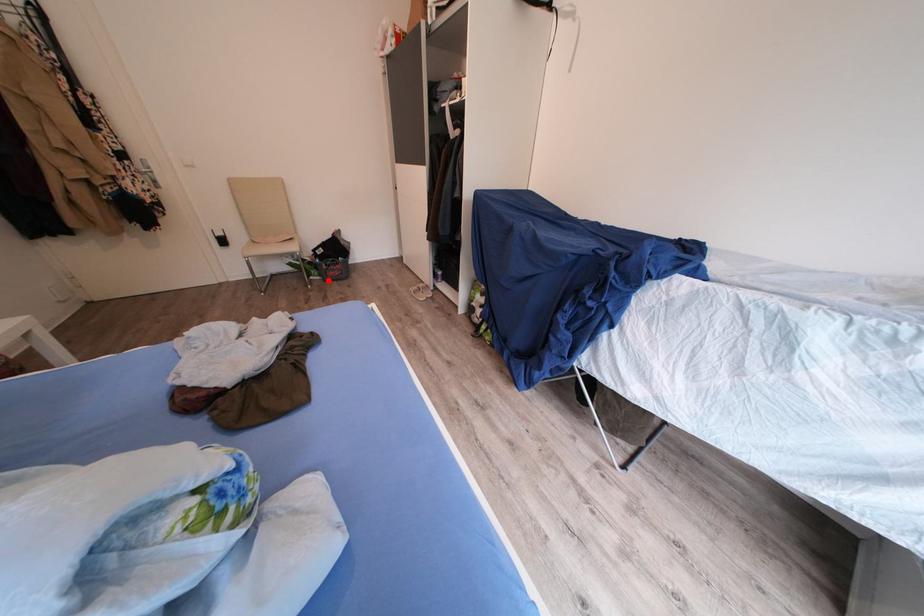
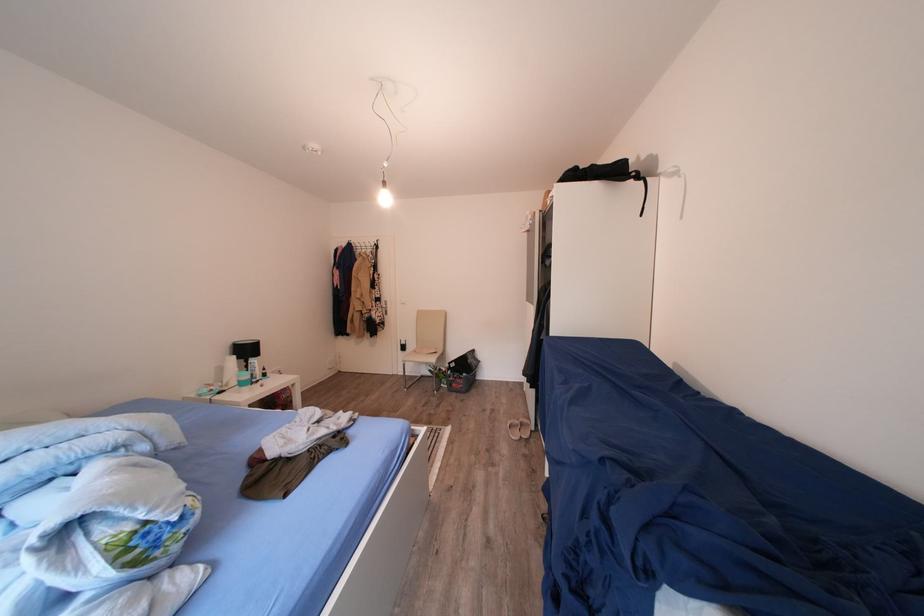
In the second image, find the point that corresponds to the highlighted location in the first image.

(456, 390)